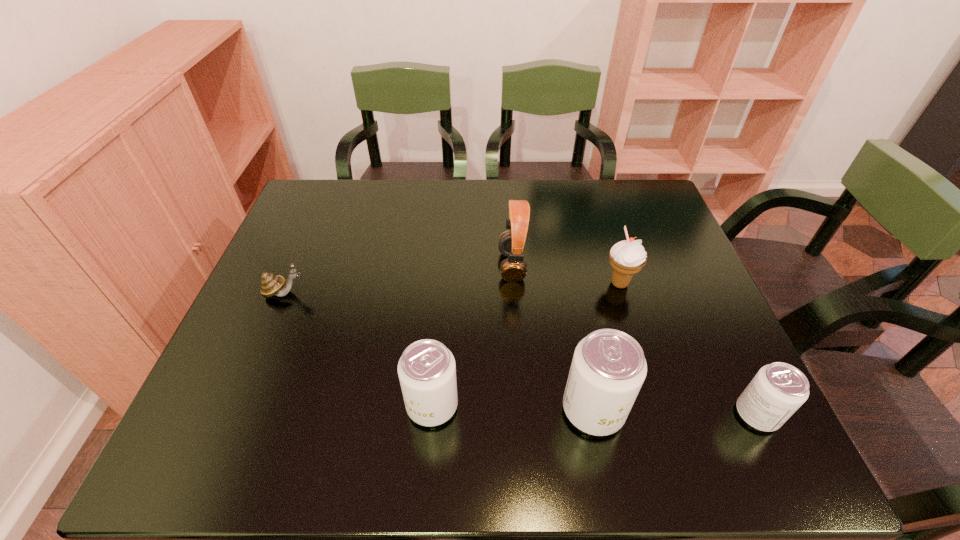
Please point out where to position a new soda can on the left to maintain spacing. Please provide its 2D coordinates. Your answer should be formatted as a tuple, i.e. [(x, y)], where the tuple contains the x and y coordinates of a point satisfying the conditions above.

[(274, 401)]